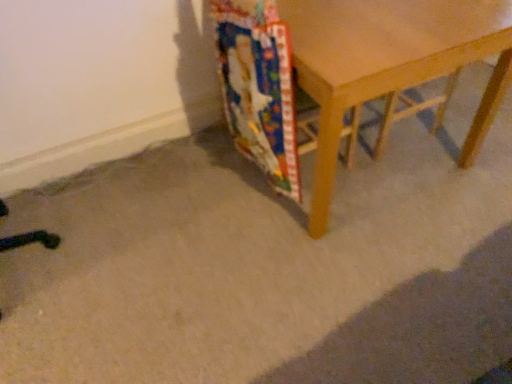
Describe the element at coordinates (390, 63) in the screenshot. I see `wooden table at lower right` at that location.

The width and height of the screenshot is (512, 384). What are the coordinates of `wooden table at lower right` in the screenshot? It's located at coord(390,63).

Identify the location of wooden table at lower right. This screenshot has width=512, height=384. (390, 63).